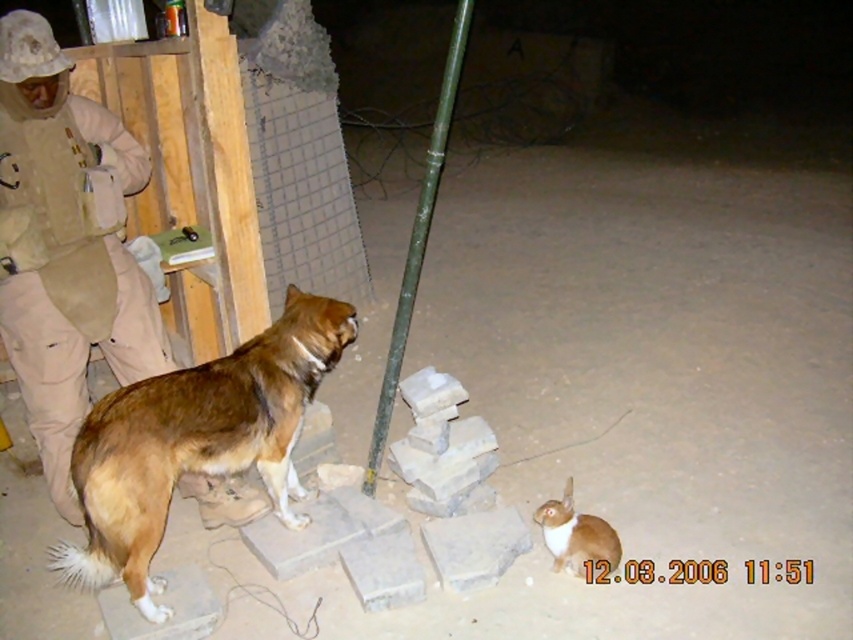
You are a photographer trying to capture a photo of the orange fur cat at lower right and the green painted wood pole at center. If you want to ensure both subjects are in focus, which one should you adjust your camera focus on first?

The green painted wood pole at center has a larger size compared to orange fur cat at lower right, so you should focus on the green painted wood pole at center first to ensure both are in focus.

You are a photographer trying to capture a photo of the brown furry dog at left and the green painted wood pole at center. Since the dog is smaller, where should you position the camera to make them appear the same size in the photo?

To make the brown furry dog at left and the green painted wood pole at center appear the same size in the photo, you should position the camera closer to the brown furry dog at left since it is smaller than the green painted wood pole at center.